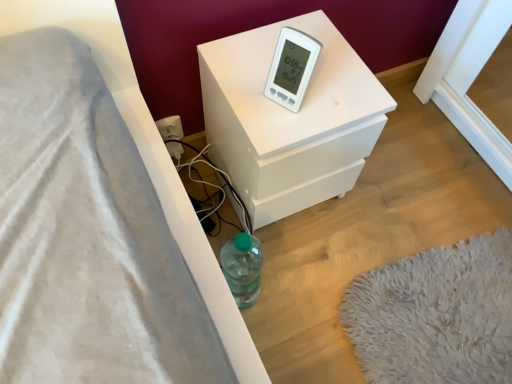
Question: Is white plastic thermometer at upper center wider or thinner than white matte nightstand at center?

Choices:
 (A) thin
 (B) wide

Answer: (A)

Question: Considering their positions, is white plastic thermometer at upper center located in front of or behind white matte nightstand at center?

Choices:
 (A) behind
 (B) front

Answer: (B)

Question: Based on their sizes in the image, would you say white plastic thermometer at upper center is bigger or smaller than white matte nightstand at center?

Choices:
 (A) big
 (B) small

Answer: (B)

Question: From a real-world perspective, relative to white plastic thermometer at upper center, is white matte nightstand at center vertically above or below?

Choices:
 (A) below
 (B) above

Answer: (A)

Question: Is white matte nightstand at center to the left or to the right of white plastic thermometer at upper center in the image?

Choices:
 (A) left
 (B) right

Answer: (B)

Question: In terms of size, does white matte nightstand at center appear bigger or smaller than white plastic thermometer at upper center?

Choices:
 (A) small
 (B) big

Answer: (B)

Question: In the image, is white matte nightstand at center positioned in front of or behind white plastic thermometer at upper center?

Choices:
 (A) behind
 (B) front

Answer: (A)